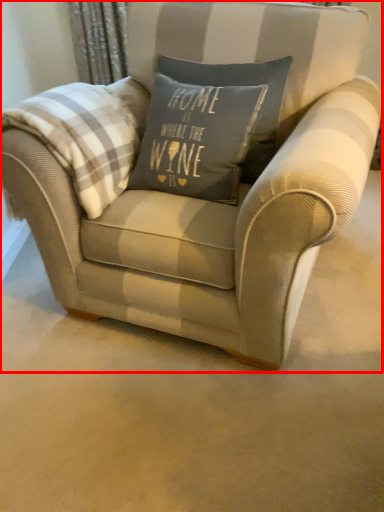
Question: From the image's perspective, considering the relative positions of chair (annotated by the red box) and plaid in the image provided, where is chair (annotated by the red box) located with respect to the staircase?

Choices:
 (A) below
 (B) above

Answer: (A)